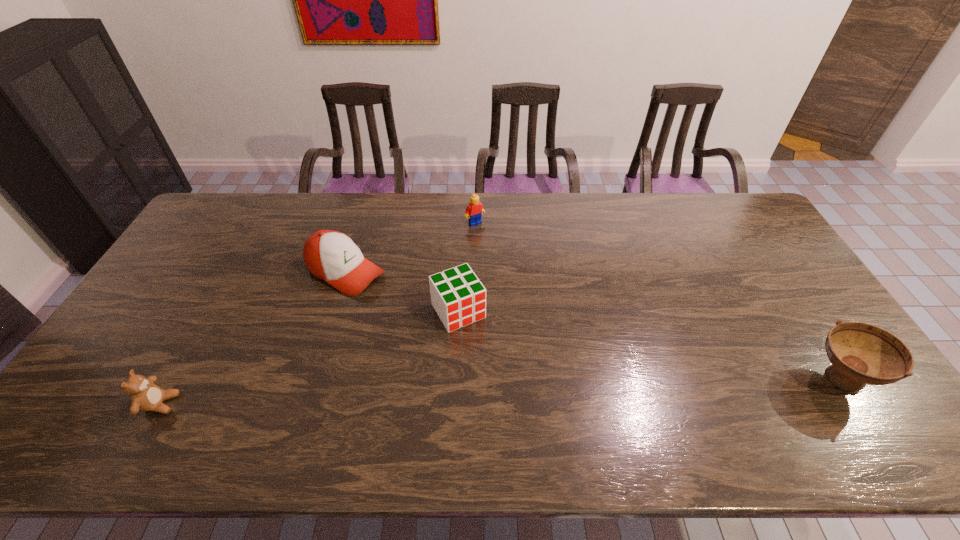
You are a GUI agent. You are given a task and a screenshot of the screen. Output one action in this format:
    pyautogui.click(x=<x>, y=<y>)
    Task: Click on the free spot between the farthest object and the leftmost object
    This screenshot has width=960, height=540.
    Given the screenshot: What is the action you would take?
    pyautogui.click(x=318, y=313)

At what (x,y) coordinates should I click in order to perform the action: click on vacant space that is in between the soup bowl and the farthest object. Please return your answer as a coordinate pair (x, y). Looking at the image, I should click on (657, 301).

Image resolution: width=960 pixels, height=540 pixels. I want to click on empty space that is in between the cube and the baseball cap, so click(402, 292).

This screenshot has height=540, width=960. I want to click on vacant point located between the leftmost object and the soup bowl, so click(x=499, y=391).

Where is `vacant area that lies between the teddy bear and the soup bowl`? The height and width of the screenshot is (540, 960). vacant area that lies between the teddy bear and the soup bowl is located at coordinates (499, 391).

Image resolution: width=960 pixels, height=540 pixels. Identify the location of free space that is in between the teddy bear and the second object from left to right. (253, 338).

Identify which object is located as the nearest to the Lego. Please provide its 2D coordinates. Your answer should be formatted as a tuple, i.e. [(x, y)], where the tuple contains the x and y coordinates of a point satisfying the conditions above.

[(332, 256)]

Where is `the closest object to the baseball cap`? the closest object to the baseball cap is located at coordinates (459, 298).